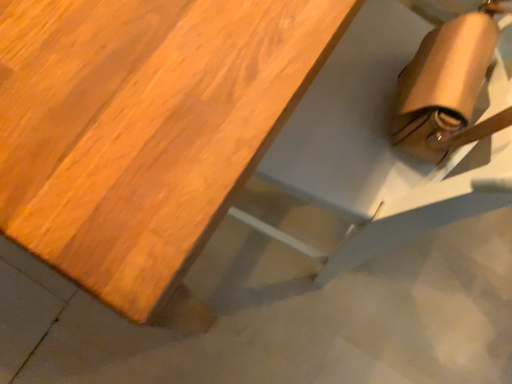
At what (x,y) coordinates should I click in order to perform the action: click on unoccupied region to the right of matte brown bag at lower right. Please return your answer as a coordinate pair (x, y). Image resolution: width=512 pixels, height=384 pixels. Looking at the image, I should click on (431, 288).